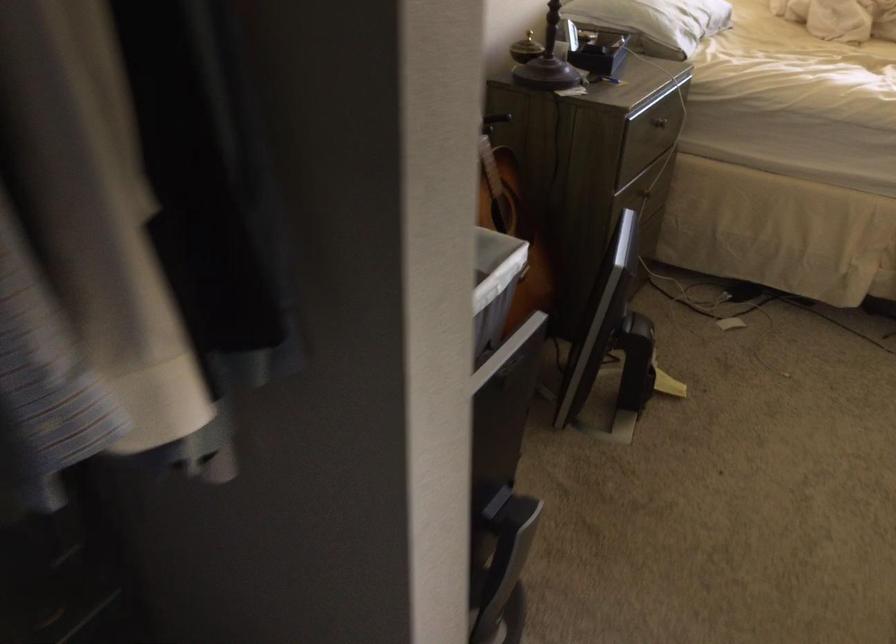
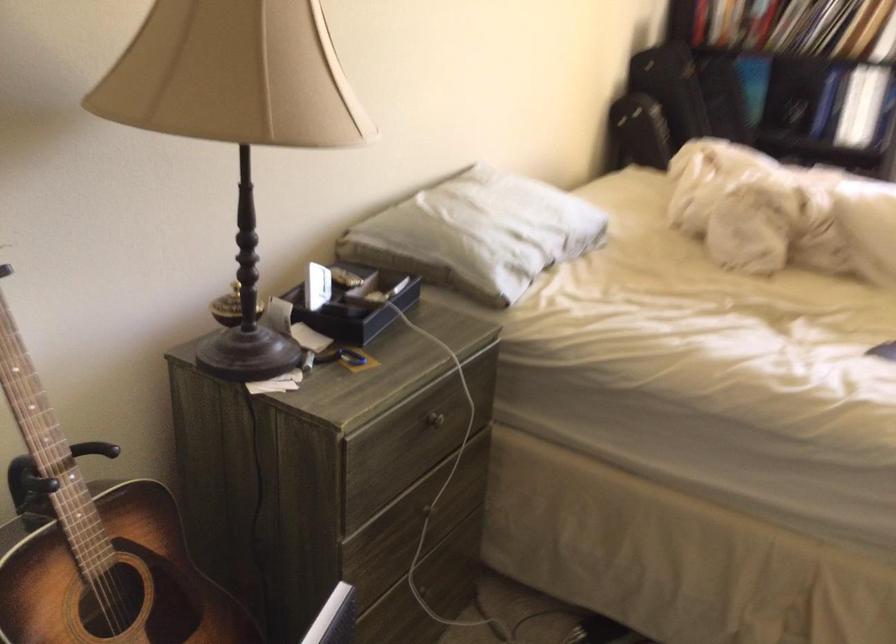
Which direction would the cameraman need to move to produce the second image?

The movement direction of the cameraman is right, forward.